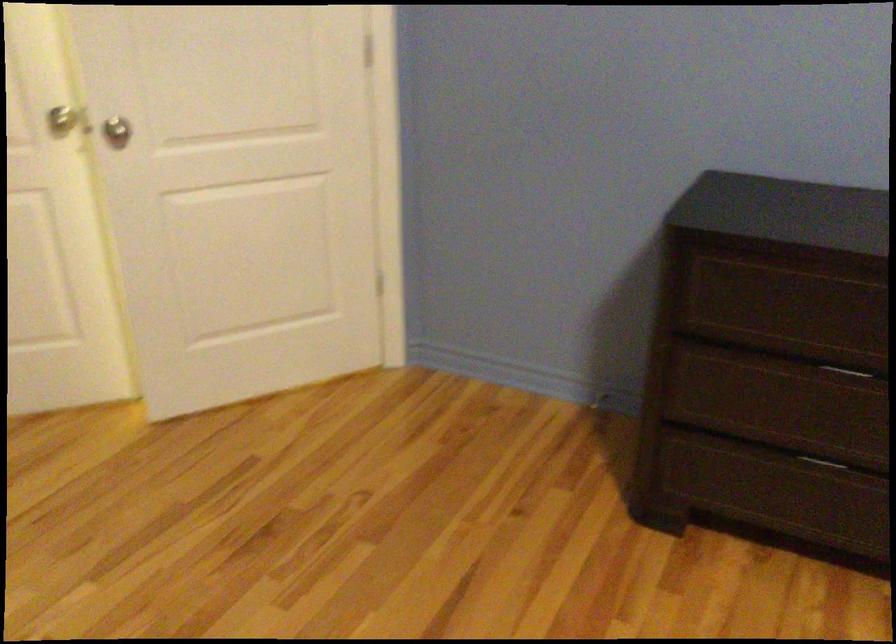
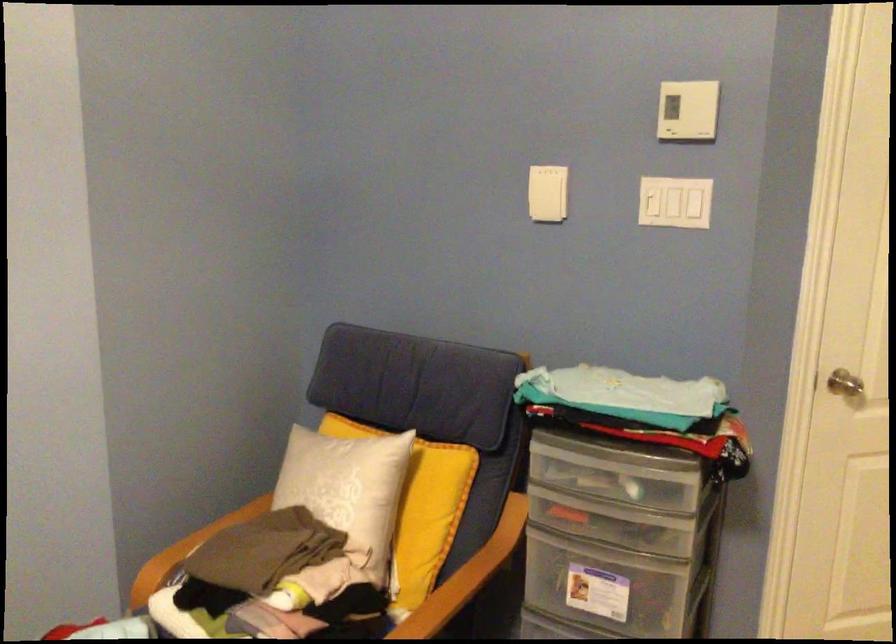
Question: How did the camera likely rotate?

Choices:
 (A) Left
 (B) Right
 (C) Up
 (D) Down

Answer: (A)